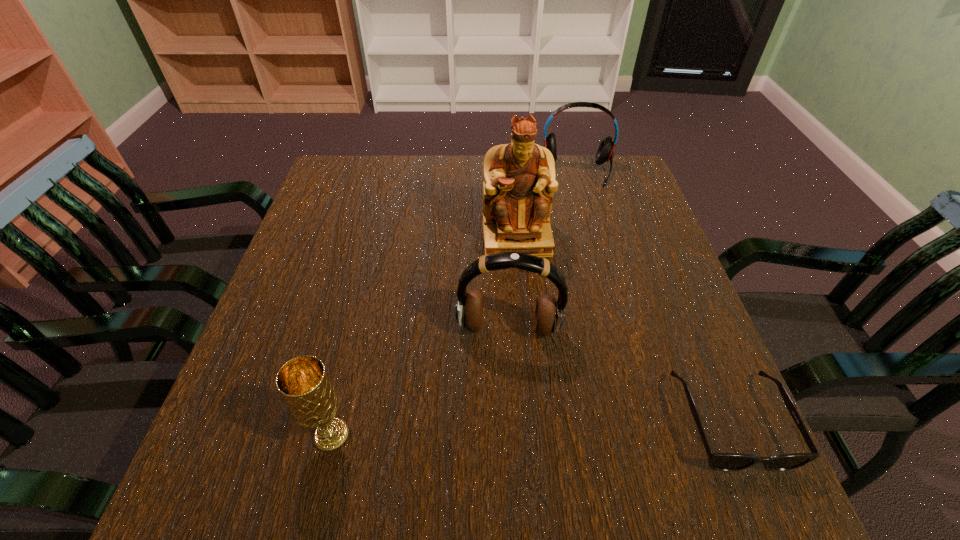
This screenshot has width=960, height=540. What are the coordinates of `chalice` in the screenshot? It's located at (303, 382).

Locate an element on the screen. the shortest object is located at coordinates (718, 461).

The height and width of the screenshot is (540, 960). Identify the location of the farthest object. click(605, 151).

Identify the location of the farther headset. Image resolution: width=960 pixels, height=540 pixels. (605, 151).

The height and width of the screenshot is (540, 960). In order to click on the fourth nearest object in this screenshot , I will do `click(519, 183)`.

This screenshot has width=960, height=540. What are the coordinates of `figurine` in the screenshot? It's located at (519, 183).

Locate an element on the screen. The image size is (960, 540). the left headset is located at coordinates (549, 315).

Find the location of a particular element. The width and height of the screenshot is (960, 540). the third nearest object is located at coordinates (549, 315).

What are the coordinates of `vacant space located on the right of the leftmost object` in the screenshot? It's located at coord(500,435).

Find the location of a particular element. free spot located 0.080m with the microphone attached to the side of the right headset is located at coordinates (578, 204).